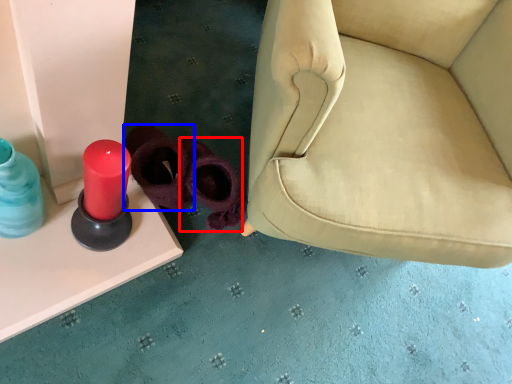
Question: Which of the following is the farthest to the observer, footwear (highlighted by a red box) or footwear (highlighted by a blue box)?

Choices:
 (A) footwear
 (B) footwear

Answer: (A)